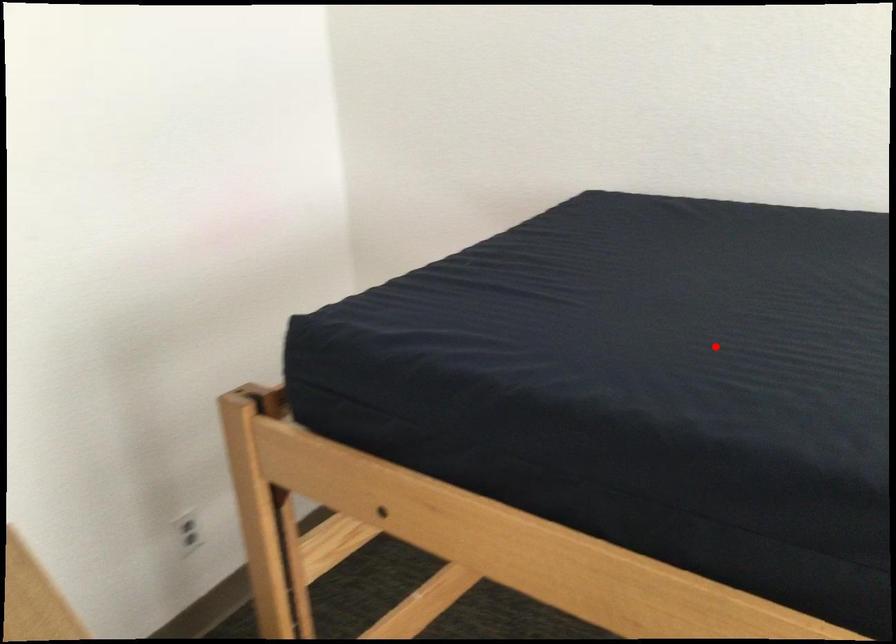
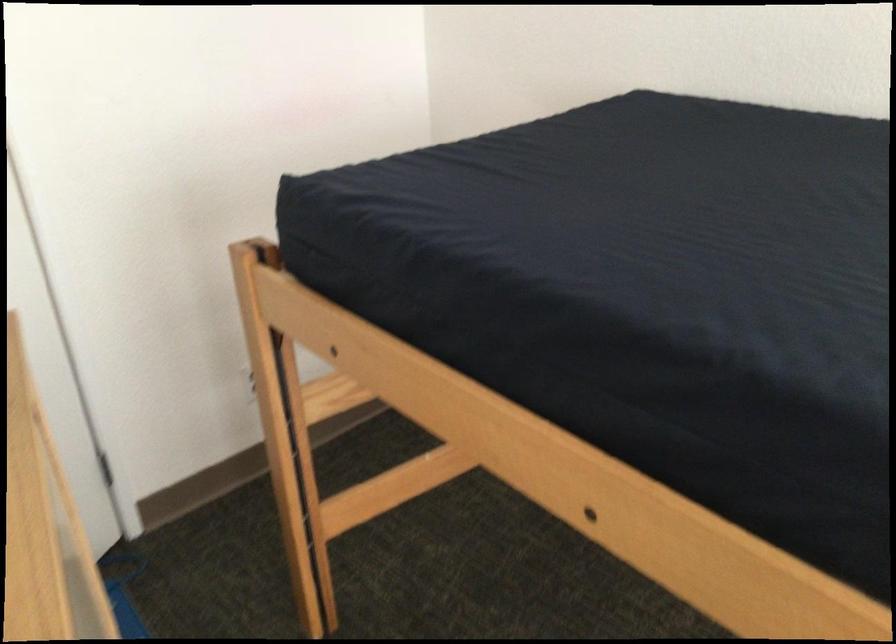
Where in the second image is the point corresponding to the highlighted location from the first image?

(636, 228)